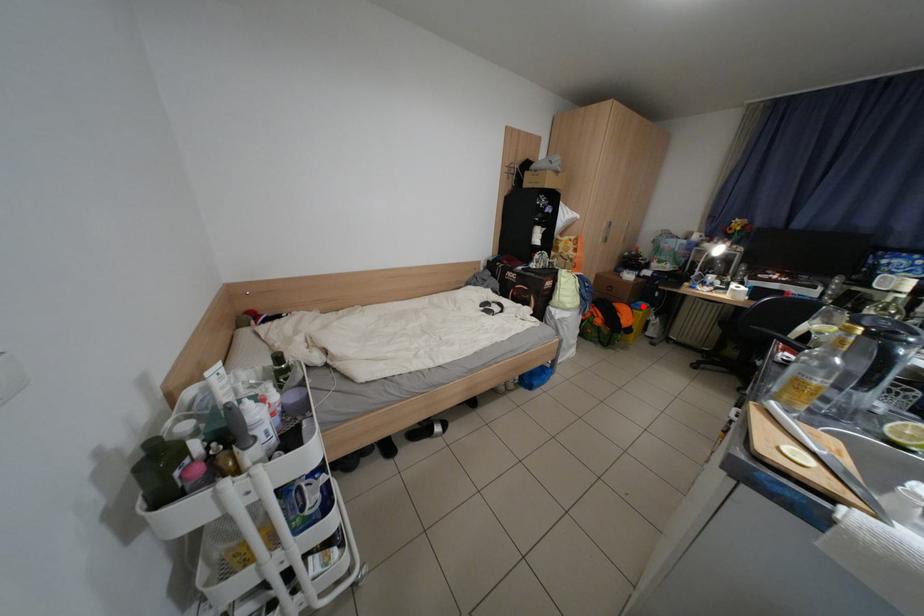
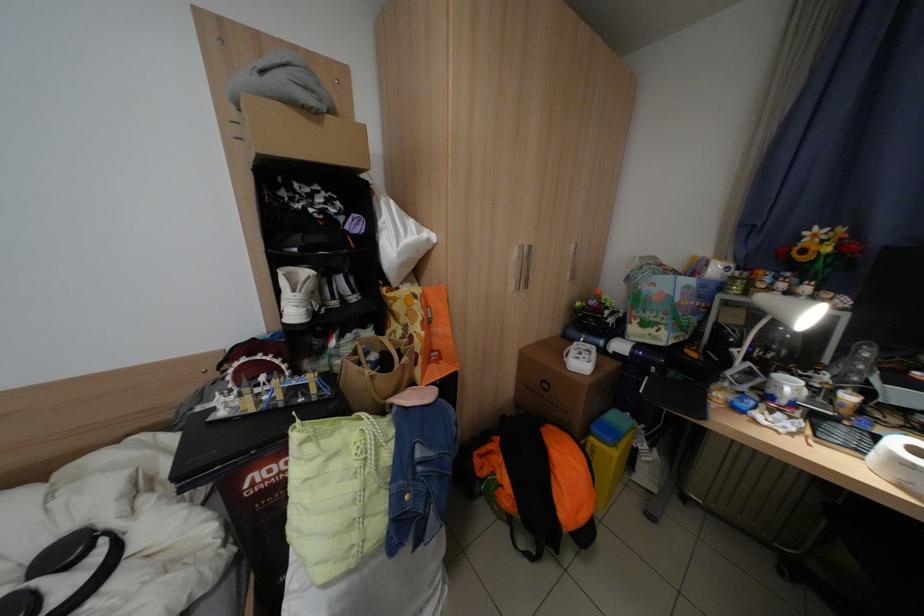
Question: I am providing you with two images of the same scene from different viewpoints. A red point is marked on the first image. Is the red point's position out of view in image 2?

Choices:
 (A) Yes
 (B) No

Answer: (B)